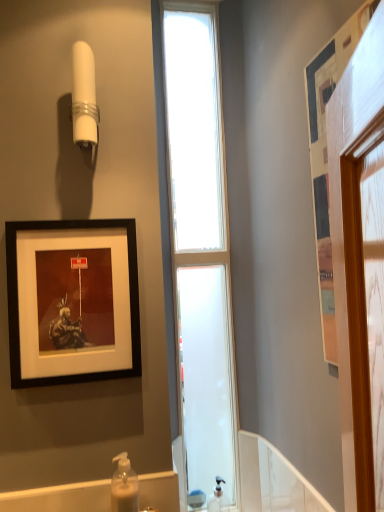
What do you see at coordinates (124, 486) in the screenshot?
I see `translucent plastic soap dispenser at lower center, the 2th soap dispenser in the right-to-left sequence` at bounding box center [124, 486].

What do you see at coordinates (200, 248) in the screenshot? This screenshot has height=512, width=384. I see `clear glass window at center` at bounding box center [200, 248].

Locate an element on the screen. This screenshot has width=384, height=512. wooden framed picture at right, the 2th picture frame when ordered from back to front is located at coordinates (327, 155).

Find the location of a particular element. This screenshot has width=384, height=512. translucent plastic soap dispenser at lower center, the 2th soap dispenser in the right-to-left sequence is located at coordinates (124, 486).

From the image's perspective, would you say black matte picture frame at upper left, which ranks as the 2th picture frame in front-to-back order, is positioned over white plastic shower at upper left?

No, from the image's perspective, black matte picture frame at upper left, which ranks as the 2th picture frame in front-to-back order, is not above white plastic shower at upper left.

Is point (12, 353) in front of point (94, 88)?

Yes, point (12, 353) is in front of point (94, 88).

Between black matte picture frame at upper left, marked as the 1th picture frame in a left-to-right arrangement, and white plastic shower at upper left, which one has smaller width?

Thinner between the two is black matte picture frame at upper left, marked as the 1th picture frame in a left-to-right arrangement.

From a real-world perspective, is black matte picture frame at upper left, marked as the 1th picture frame in a left-to-right arrangement, above or below white plastic shower at upper left?

black matte picture frame at upper left, marked as the 1th picture frame in a left-to-right arrangement, is below white plastic shower at upper left.

Based on the photo, in terms of width, does translucent plastic soap dispenser at lower center, arranged as the 2th soap dispenser when viewed from the back, look wider or thinner when compared to clear plastic soap dispenser at lower center, the 2th soap dispenser viewed from the left?

Clearly, translucent plastic soap dispenser at lower center, arranged as the 2th soap dispenser when viewed from the back, has more width compared to clear plastic soap dispenser at lower center, the 2th soap dispenser viewed from the left.

Considering the relative positions of translucent plastic soap dispenser at lower center, positioned as the 1th soap dispenser in left-to-right order, and clear plastic soap dispenser at lower center, the 1th soap dispenser when ordered from back to front, in the image provided, is translucent plastic soap dispenser at lower center, positioned as the 1th soap dispenser in left-to-right order, to the left or to the right of clear plastic soap dispenser at lower center, the 1th soap dispenser when ordered from back to front,?

translucent plastic soap dispenser at lower center, positioned as the 1th soap dispenser in left-to-right order, is positioned on clear plastic soap dispenser at lower center, the 1th soap dispenser when ordered from back to front,'s left side.

From the image's perspective, is translucent plastic soap dispenser at lower center, the 2th soap dispenser in the right-to-left sequence, on top of clear plastic soap dispenser at lower center, which is counted as the second soap dispenser, starting from the top?

Yes, from the image's perspective, translucent plastic soap dispenser at lower center, the 2th soap dispenser in the right-to-left sequence, is on top of clear plastic soap dispenser at lower center, which is counted as the second soap dispenser, starting from the top.

Measure the distance from wooden framed picture at right, the 2th picture frame when ordered from back to front, to clear plastic soap dispenser at lower center, the 2th soap dispenser viewed from the left.

wooden framed picture at right, the 2th picture frame when ordered from back to front, and clear plastic soap dispenser at lower center, the 2th soap dispenser viewed from the left, are 3.64 feet apart.

There is a wooden framed picture at right, the first picture frame positioned from the right. At what (x,y) coordinates should I click in order to perform the action: click on the 2nd soap dispenser below it (from a real-world perspective). Please return your answer as a coordinate pair (x, y). The height and width of the screenshot is (512, 384). Looking at the image, I should click on (218, 498).

Is wooden framed picture at right, arranged as the 2th picture frame when viewed from the left, oriented towards clear plastic soap dispenser at lower center, arranged as the first soap dispenser when viewed from the right?

No, wooden framed picture at right, arranged as the 2th picture frame when viewed from the left, is not oriented towards clear plastic soap dispenser at lower center, arranged as the first soap dispenser when viewed from the right.

In the scene shown: How different are the orientations of wooden framed picture at right, the 1th picture frame from the front, and clear plastic soap dispenser at lower center, which is counted as the second soap dispenser, starting from the top, in degrees?

They differ by 86.9 degrees in their facing directions.

Who is bigger, white plastic shower at upper left or clear plastic soap dispenser at lower center, the 1th soap dispenser when ordered from back to front?

Bigger between the two is white plastic shower at upper left.

Is white plastic shower at upper left oriented away from clear plastic soap dispenser at lower center, which is counted as the second soap dispenser, starting from the top?

No, clear plastic soap dispenser at lower center, which is counted as the second soap dispenser, starting from the top, is not at the back of white plastic shower at upper left.

Considering the positions of point (79, 129) and point (216, 505), is point (79, 129) closer or farther from the camera than point (216, 505)?

Point (79, 129).

From a real-world perspective, who is located higher, white plastic shower at upper left or clear plastic soap dispenser at lower center, the 1th soap dispenser when ordered from back to front?

white plastic shower at upper left is physically above.

Considering the relative sizes of white plastic shower at upper left and wooden framed picture at right, the first picture frame positioned from the right, in the image provided, is white plastic shower at upper left wider than wooden framed picture at right, the first picture frame positioned from the right,?

Correct, the width of white plastic shower at upper left exceeds that of wooden framed picture at right, the first picture frame positioned from the right.

Considering the sizes of white plastic shower at upper left and wooden framed picture at right, arranged as the 2th picture frame when viewed from the left, in the image, is white plastic shower at upper left bigger or smaller than wooden framed picture at right, arranged as the 2th picture frame when viewed from the left,?

In the image, white plastic shower at upper left appears to be smaller than wooden framed picture at right, arranged as the 2th picture frame when viewed from the left.

Is white plastic shower at upper left not near wooden framed picture at right, the 2th picture frame when ordered from back to front?

No, white plastic shower at upper left is in close proximity to wooden framed picture at right, the 2th picture frame when ordered from back to front.

From a real-world perspective, who is located higher, white plastic shower at upper left or wooden framed picture at right, the 2th picture frame when ordered from back to front?

From a 3D spatial view, white plastic shower at upper left is above.

Who is taller, black matte picture frame at upper left, the 1th picture frame when ordered from back to front, or translucent plastic soap dispenser at lower center, arranged as the 2th soap dispenser when viewed from the back?

black matte picture frame at upper left, the 1th picture frame when ordered from back to front, is taller.

Who is more distant, black matte picture frame at upper left, which ranks as the 2th picture frame in front-to-back order, or translucent plastic soap dispenser at lower center, the 1th soap dispenser from the top?

black matte picture frame at upper left, which ranks as the 2th picture frame in front-to-back order, is more distant.

Which is more to the left, black matte picture frame at upper left, the 1th picture frame when ordered from back to front, or translucent plastic soap dispenser at lower center, the 1th soap dispenser viewed from the front?

black matte picture frame at upper left, the 1th picture frame when ordered from back to front, is more to the left.

Which of these two, clear plastic soap dispenser at lower center, the first soap dispenser from the bottom, or clear glass window at center, is wider?

clear glass window at center.

From the picture: Between clear plastic soap dispenser at lower center, the first soap dispenser from the bottom, and clear glass window at center, which one has larger size?

With larger size is clear glass window at center.

Is clear plastic soap dispenser at lower center, arranged as the first soap dispenser when viewed from the right, not within clear glass window at center?

Absolutely, clear plastic soap dispenser at lower center, arranged as the first soap dispenser when viewed from the right, is external to clear glass window at center.

From a real-world perspective, is clear plastic soap dispenser at lower center, the first soap dispenser from the bottom, on top of clear glass window at center?

No, from a real-world perspective, clear plastic soap dispenser at lower center, the first soap dispenser from the bottom, is not on top of clear glass window at center.

The height and width of the screenshot is (512, 384). I want to click on picture frame on the left of white plastic shower at upper left, so click(x=72, y=301).

This screenshot has height=512, width=384. Identify the location of soap dispenser below the translucent plastic soap dispenser at lower center, the 2th soap dispenser in the right-to-left sequence (from the image's perspective). (218, 498).

Which object lies nearer to the anchor point clear plastic soap dispenser at lower center, which is counted as the second soap dispenser, starting from the top, translucent plastic soap dispenser at lower center, the 1th soap dispenser viewed from the front, or white plastic shower at upper left?

translucent plastic soap dispenser at lower center, the 1th soap dispenser viewed from the front, is positioned closer to the anchor clear plastic soap dispenser at lower center, which is counted as the second soap dispenser, starting from the top.

From the image, which object appears to be farther from translucent plastic soap dispenser at lower center, positioned as the 1th soap dispenser in left-to-right order, wooden framed picture at right, the first picture frame positioned from the right, or clear plastic soap dispenser at lower center, the 1th soap dispenser when ordered from back to front?

Among the two, wooden framed picture at right, the first picture frame positioned from the right, is located further to translucent plastic soap dispenser at lower center, positioned as the 1th soap dispenser in left-to-right order.

Looking at the image, which one is located closer to wooden framed picture at right, the 2th picture frame when ordered from back to front, clear plastic soap dispenser at lower center, the 1th soap dispenser when ordered from back to front, or black matte picture frame at upper left, marked as the 1th picture frame in a left-to-right arrangement?

black matte picture frame at upper left, marked as the 1th picture frame in a left-to-right arrangement.

When comparing their distances from black matte picture frame at upper left, marked as the 1th picture frame in a left-to-right arrangement, does wooden framed picture at right, the 2th picture frame when ordered from back to front, or clear glass window at center seem further?

wooden framed picture at right, the 2th picture frame when ordered from back to front, is further to black matte picture frame at upper left, marked as the 1th picture frame in a left-to-right arrangement.

From the image, which object appears to be farther from wooden framed picture at right, the first picture frame positioned from the right, translucent plastic soap dispenser at lower center, the 2th soap dispenser in the right-to-left sequence, or white plastic shower at upper left?

Based on the image, translucent plastic soap dispenser at lower center, the 2th soap dispenser in the right-to-left sequence, appears to be further to wooden framed picture at right, the first picture frame positioned from the right.

Considering their positions, is white plastic shower at upper left positioned further to clear plastic soap dispenser at lower center, the 2th soap dispenser viewed from the left, than clear glass window at center?

white plastic shower at upper left lies further to clear plastic soap dispenser at lower center, the 2th soap dispenser viewed from the left, than the other object.

Which object lies nearer to the anchor point white plastic shower at upper left, wooden framed picture at right, arranged as the 2th picture frame when viewed from the left, or black matte picture frame at upper left, the 1th picture frame when ordered from back to front?

black matte picture frame at upper left, the 1th picture frame when ordered from back to front, is closer to white plastic shower at upper left.

From the image, which object appears to be nearer to white plastic shower at upper left, translucent plastic soap dispenser at lower center, the 2th soap dispenser in the right-to-left sequence, or clear plastic soap dispenser at lower center, the first soap dispenser from the bottom?

translucent plastic soap dispenser at lower center, the 2th soap dispenser in the right-to-left sequence.

At what (x,y) coordinates should I click in order to perform the action: click on window that lies between white plastic shower at upper left and black matte picture frame at upper left, which ranks as the 2th picture frame in front-to-back order, from top to bottom. Please return your answer as a coordinate pair (x, y). This screenshot has height=512, width=384. Looking at the image, I should click on (200, 248).

Locate an element on the screen. The image size is (384, 512). shower between wooden framed picture at right, the 2th picture frame when ordered from back to front, and clear glass window at center, along the z-axis is located at coordinates (84, 97).

Locate an element on the screen. window between white plastic shower at upper left and translucent plastic soap dispenser at lower center, the 1th soap dispenser viewed from the front, in the vertical direction is located at coordinates (200, 248).

The height and width of the screenshot is (512, 384). Find the location of `picture frame between wooden framed picture at right, the first picture frame positioned from the right, and translucent plastic soap dispenser at lower center, the 2th soap dispenser in the right-to-left sequence, from top to bottom`. picture frame between wooden framed picture at right, the first picture frame positioned from the right, and translucent plastic soap dispenser at lower center, the 2th soap dispenser in the right-to-left sequence, from top to bottom is located at coordinates (72, 301).